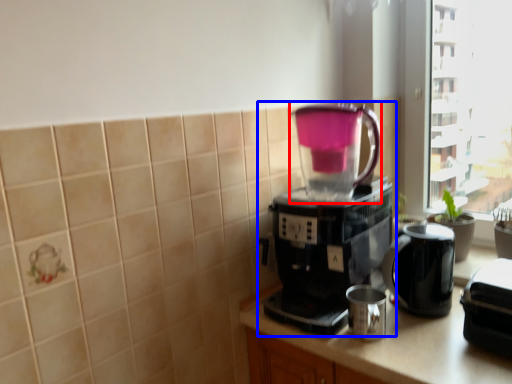
Question: Which of the following is the closest to the observer, coffeepot (highlighted by a red box) or coffee maker (highlighted by a blue box)?

Choices:
 (A) coffeepot
 (B) coffee maker

Answer: (B)